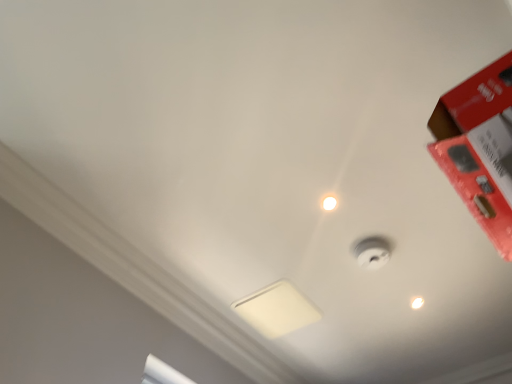
Question: From the image's perspective, is white matte lamp at center located above or below white glossy droplight at upper center?

Choices:
 (A) below
 (B) above

Answer: (A)

Question: From their relative heights in the image, would you say white matte lamp at center is taller or shorter than white glossy droplight at upper center?

Choices:
 (A) short
 (B) tall

Answer: (A)

Question: Which is nearer to the white glossy light bulb at upper center?

Choices:
 (A) white matte lamp at center
 (B) red matte box at upper right
 (C) white glossy droplight at upper center

Answer: (A)

Question: Which of these objects is positioned closest to the red matte box at upper right?

Choices:
 (A) white glossy light bulb at upper center
 (B) white matte lamp at center
 (C) white glossy droplight at upper center

Answer: (C)